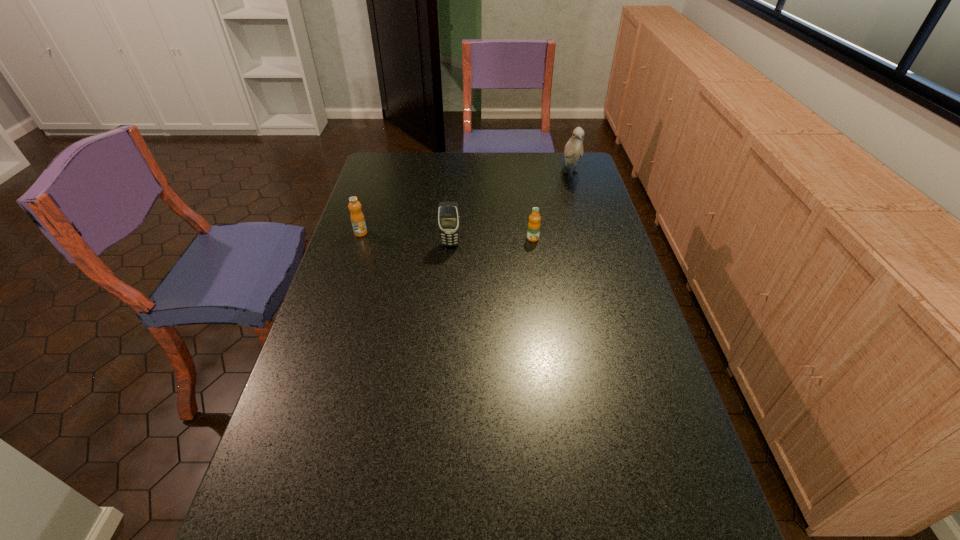
At what (x,y) coordinates should I click in order to perform the action: click on free spot between the tallest object and the cellular telephone. Please return your answer as a coordinate pair (x, y). The height and width of the screenshot is (540, 960). Looking at the image, I should click on (510, 208).

Image resolution: width=960 pixels, height=540 pixels. In order to click on vacant area that lies between the tallest object and the cellular telephone in this screenshot , I will do `click(510, 208)`.

Where is `the closest object to the cellular telephone`? This screenshot has height=540, width=960. the closest object to the cellular telephone is located at coordinates (533, 232).

Identify which object is the third nearest to the second object from right to left. Please provide its 2D coordinates. Your answer should be formatted as a tuple, i.e. [(x, y)], where the tuple contains the x and y coordinates of a point satisfying the conditions above.

[(357, 218)]